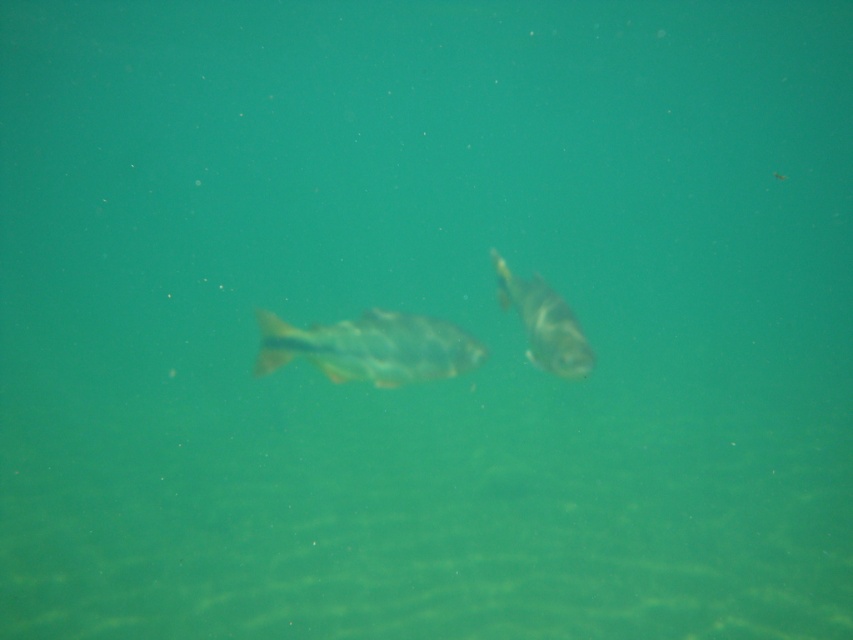
Question: Can you confirm if speckled silver fish at center is positioned to the right of shiny silver fish at center?

Choices:
 (A) no
 (B) yes

Answer: (A)

Question: Where is speckled silver fish at center located in relation to shiny silver fish at center in the image?

Choices:
 (A) right
 (B) left

Answer: (B)

Question: Which point is farther to the camera?

Choices:
 (A) speckled silver fish at center
 (B) shiny silver fish at center

Answer: (B)

Question: Does speckled silver fish at center appear on the right side of shiny silver fish at center?

Choices:
 (A) yes
 (B) no

Answer: (B)

Question: Which point is farther to the camera?

Choices:
 (A) speckled silver fish at center
 (B) shiny silver fish at center

Answer: (B)